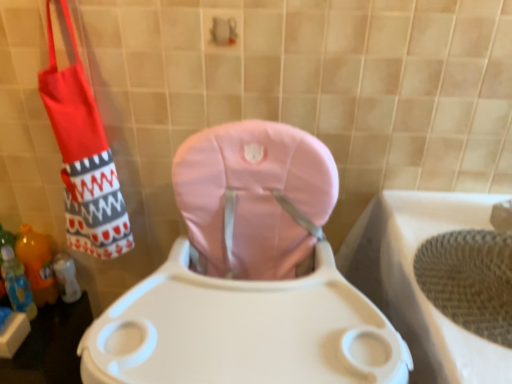
Find the location of a particular element. This screenshot has width=512, height=384. vacant space in front of translucent orange bottle at lower left, the second bottle positioned from the front is located at coordinates (38, 339).